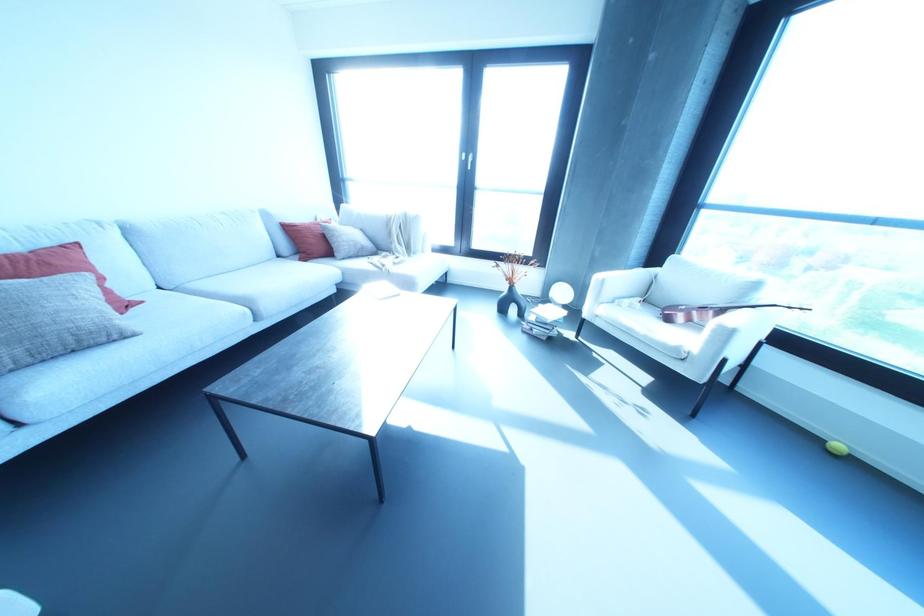
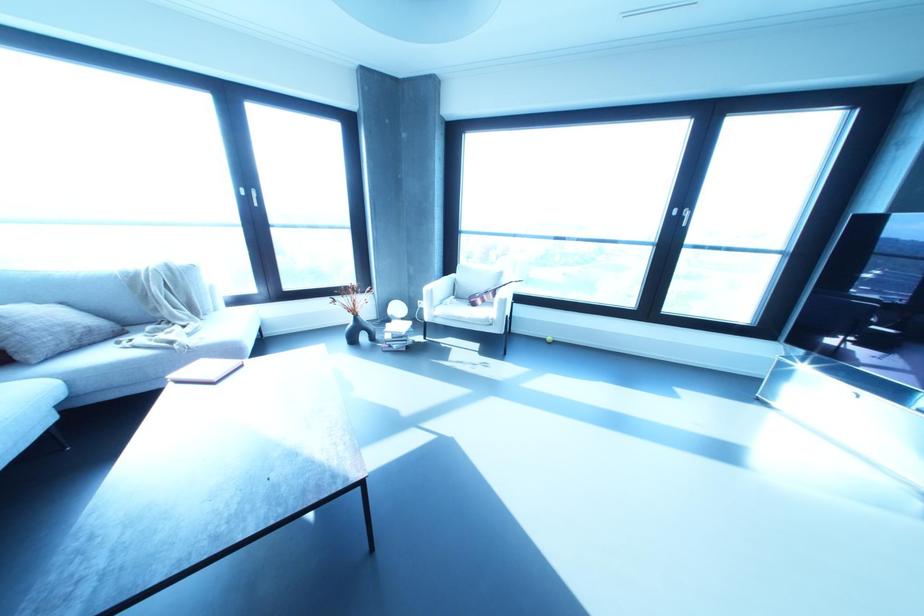
Locate, in the second image, the point that corresponds to [597,276] in the first image.

(426, 288)